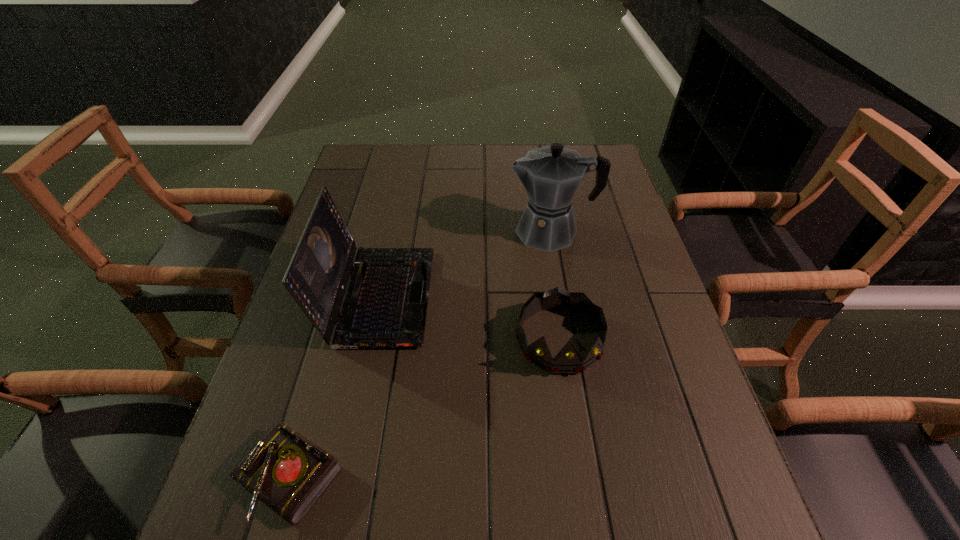
I want to click on empty location between the second tallest object and the shortest object, so click(x=334, y=387).

At what (x,y) coordinates should I click in order to perform the action: click on unoccupied position between the coffeepot and the shortest object. Please return your answer as a coordinate pair (x, y). This screenshot has height=540, width=960. Looking at the image, I should click on (420, 355).

Where is `free area in between the laptop computer and the farthest object`? The height and width of the screenshot is (540, 960). free area in between the laptop computer and the farthest object is located at coordinates (465, 264).

Locate an element on the screen. This screenshot has width=960, height=540. empty space between the second tallest object and the shortest object is located at coordinates (334, 387).

At what (x,y) coordinates should I click in order to perform the action: click on free space between the laptop computer and the shortest object. Please return your answer as a coordinate pair (x, y). The width and height of the screenshot is (960, 540). Looking at the image, I should click on pos(334,387).

Image resolution: width=960 pixels, height=540 pixels. Find the location of `empty space between the farthest object and the shortest object`. empty space between the farthest object and the shortest object is located at coordinates (420, 355).

Find the location of a particular element. The width and height of the screenshot is (960, 540). blank region between the farthest object and the diary is located at coordinates (420, 355).

The image size is (960, 540). I want to click on vacant region between the coffeepot and the shortest object, so click(x=420, y=355).

The height and width of the screenshot is (540, 960). What are the coordinates of `free space between the shortest object and the laptop computer` in the screenshot? It's located at (334, 387).

Find the location of a particular element. The width and height of the screenshot is (960, 540). unoccupied area between the coffeepot and the diary is located at coordinates (420, 355).